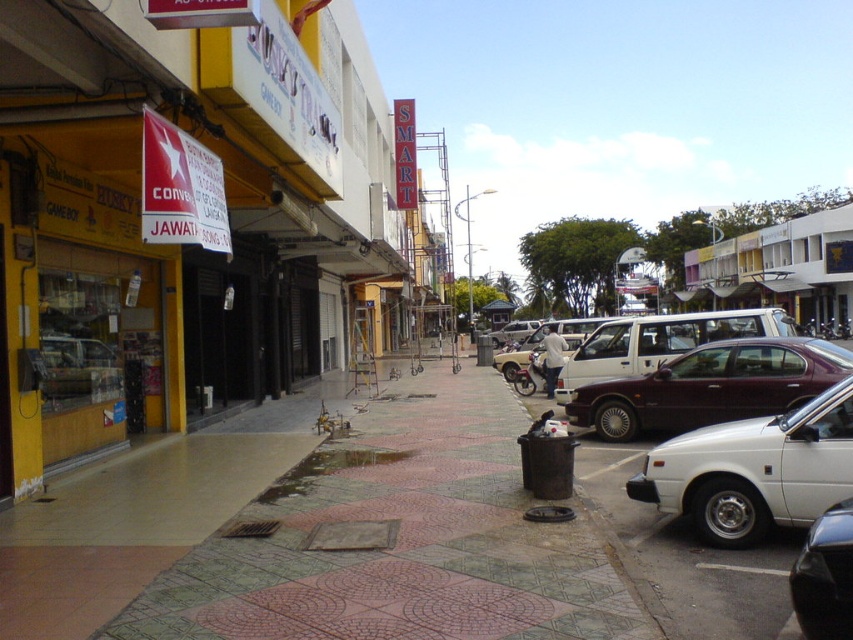
Based on the photo, between yellow matte building at center and white matte van at center-right, which one has more height?

With more height is yellow matte building at center.

What do you see at coordinates (195, 221) in the screenshot? The width and height of the screenshot is (853, 640). I see `yellow matte building at center` at bounding box center [195, 221].

Describe the element at coordinates (195, 221) in the screenshot. The width and height of the screenshot is (853, 640). I see `yellow matte building at center` at that location.

Locate an element on the screen. Image resolution: width=853 pixels, height=640 pixels. yellow matte building at center is located at coordinates (195, 221).

Does maroon metallic sedan at center-right appear over shiny black car at lower right?

Correct, maroon metallic sedan at center-right is located above shiny black car at lower right.

You are a GUI agent. You are given a task and a screenshot of the screen. Output one action in this format:
    pyautogui.click(x=<x>, y=<y>)
    Task: Click on the maroon metallic sedan at center-right
    The width and height of the screenshot is (853, 640).
    Given the screenshot: What is the action you would take?
    pyautogui.click(x=711, y=387)

Does yellow matte building at center have a greater width compared to maroon metallic car at right?

No, yellow matte building at center is not wider than maroon metallic car at right.

Who is more distant from viewer, (x=111, y=358) or (x=722, y=589)?

Point (x=111, y=358)

The height and width of the screenshot is (640, 853). Identify the location of yellow matte building at center. (195, 221).